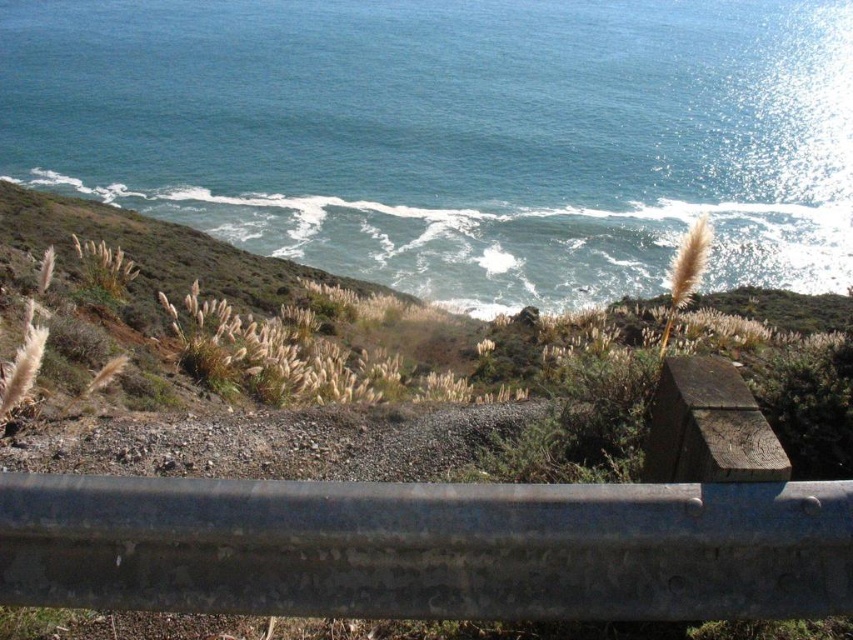
Does blue water at upper center have a smaller size compared to gray metallic rail at center?

No, blue water at upper center is not smaller than gray metallic rail at center.

Where is `blue water at upper center`? Image resolution: width=853 pixels, height=640 pixels. blue water at upper center is located at coordinates (454, 134).

Locate an element on the screen. blue water at upper center is located at coordinates point(454,134).

Does blue water at upper center have a lesser width compared to dry grass at center?

Incorrect, blue water at upper center's width is not less than dry grass at center's.

Between point (363, 163) and point (157, 330), which one is positioned behind?

Point (363, 163)

I want to click on blue water at upper center, so click(x=454, y=134).

Between point (231, 275) and point (397, 552), which one is positioned behind?

Positioned behind is point (231, 275).

Can you confirm if dry grass at center is bigger than gray metallic rail at center?

Yes.

Who is more distant from viewer, (x=221, y=291) or (x=265, y=545)?

The point (x=221, y=291) is behind.

Where is `dry grass at center`? This screenshot has width=853, height=640. dry grass at center is located at coordinates (337, 369).